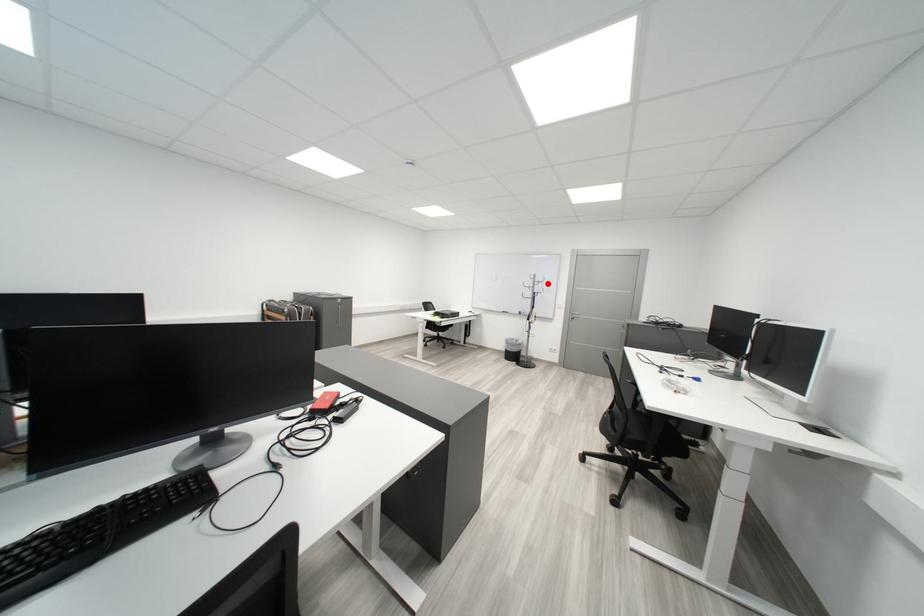
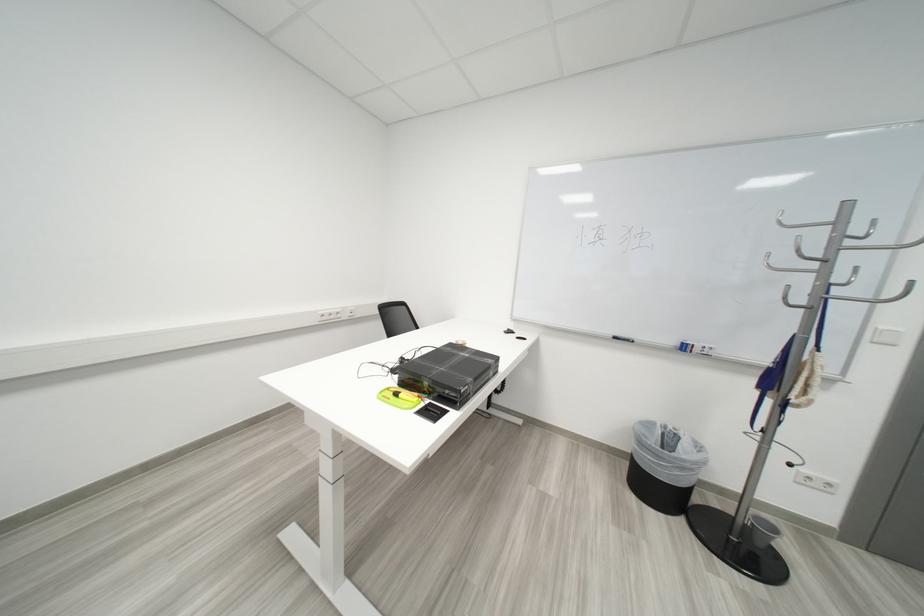
In the second image, find the point that corresponds to the highlighted location in the first image.

(853, 238)